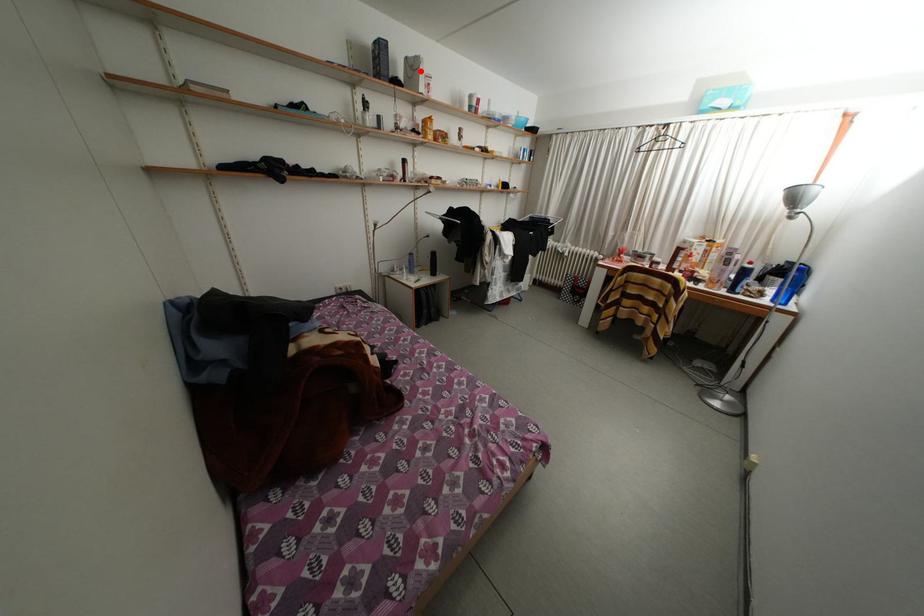
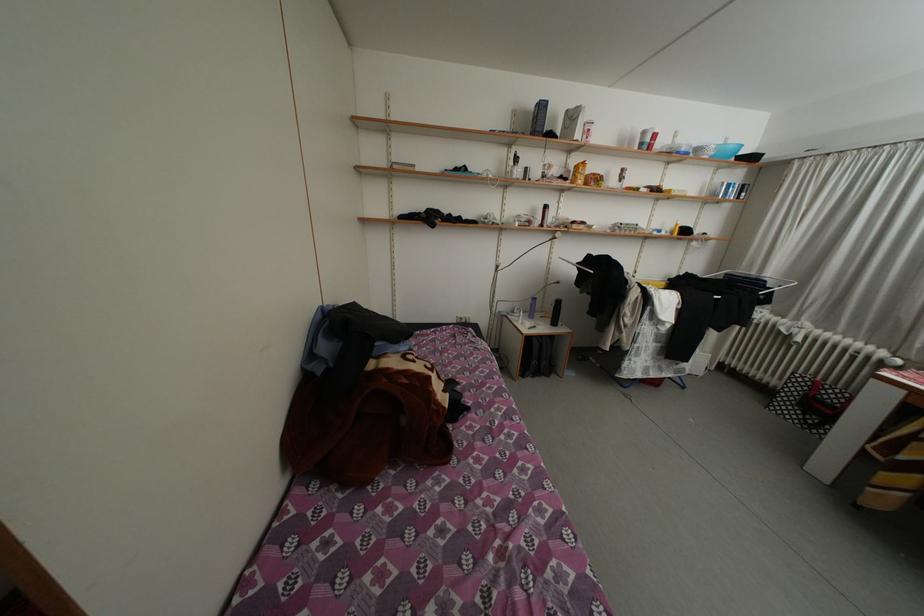
In the second image, find the point that corresponds to the highlighted location in the first image.

(580, 122)